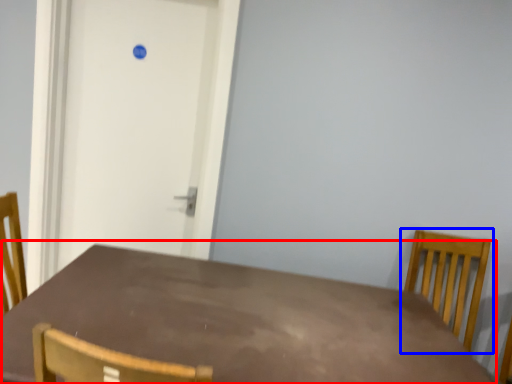
Question: Which object appears farthest to the camera in this image, table (highlighted by a red box) or chair (highlighted by a blue box)?

Choices:
 (A) table
 (B) chair

Answer: (B)